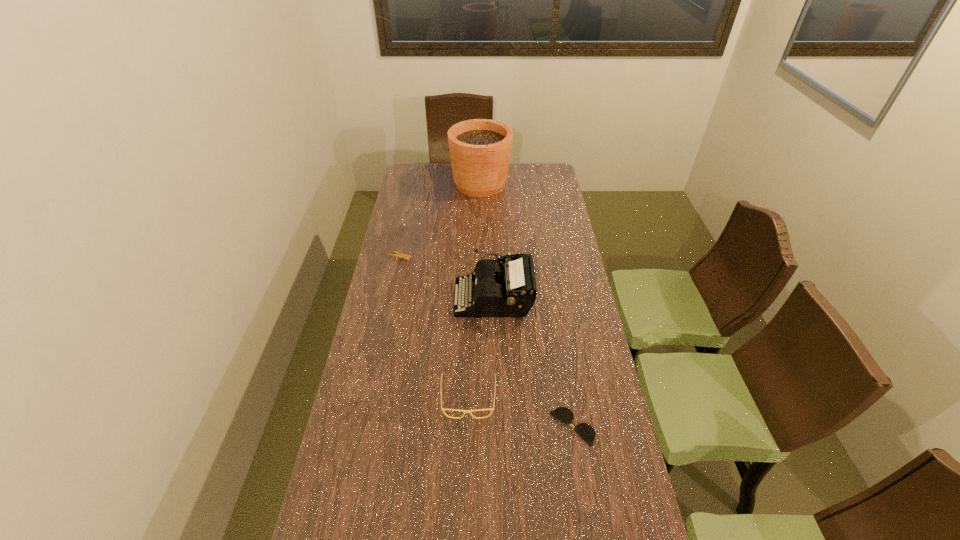
The width and height of the screenshot is (960, 540). Find the location of `free spot between the leftmost object and the right spectacles`. free spot between the leftmost object and the right spectacles is located at coordinates (487, 342).

You are a GUI agent. You are given a task and a screenshot of the screen. Output one action in this format:
    pyautogui.click(x=<x>, y=<y>)
    Task: Click on the vacant area that lies between the shorter spectacles and the third tallest object
    The height and width of the screenshot is (540, 960).
    Given the screenshot: What is the action you would take?
    pyautogui.click(x=520, y=413)

This screenshot has width=960, height=540. Identify the location of blank region between the fourth shortest object and the leftmost object. (447, 278).

The width and height of the screenshot is (960, 540). In order to click on free spot between the taller spectacles and the shorter spectacles in this screenshot , I will do `click(520, 413)`.

Where is `the second closest object to the tallest object`? Image resolution: width=960 pixels, height=540 pixels. the second closest object to the tallest object is located at coordinates tap(508, 289).

Find the location of a particular element. The image size is (960, 540). object that is the third closest to the rightmost object is located at coordinates [x=399, y=255].

Where is `free space that satisfies the following two spatial constraints: 1. on the typing side of the rightmost object; 2. on the left side of the typewriter`? The height and width of the screenshot is (540, 960). free space that satisfies the following two spatial constraints: 1. on the typing side of the rightmost object; 2. on the left side of the typewriter is located at coordinates (497, 427).

I want to click on free space that satisfies the following two spatial constraints: 1. on the back side of the flowerpot; 2. on the right side of the clothespin, so click(x=416, y=184).

Where is `free space in the image that satisfies the following two spatial constraints: 1. in front of the lenses of the taller spectacles; 2. on the left side of the rightmost object`? free space in the image that satisfies the following two spatial constraints: 1. in front of the lenses of the taller spectacles; 2. on the left side of the rightmost object is located at coordinates (468, 427).

I want to click on free space in the image that satisfies the following two spatial constraints: 1. on the typing side of the typewriter; 2. in front of the lenses of the third shortest object, so click(497, 399).